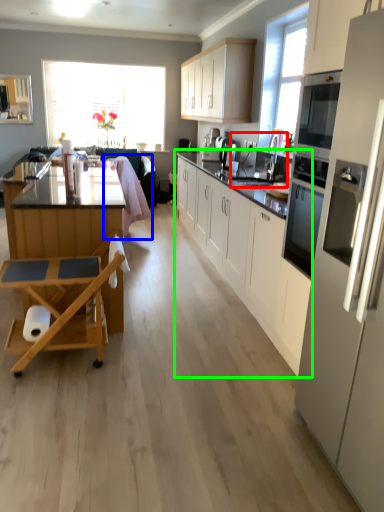
Question: Based on their relative distances, which object is nearer to sink (highlighted by a red box)? Choose from swivel chair (highlighted by a blue box) and cabinetry (highlighted by a green box).

Choices:
 (A) swivel chair
 (B) cabinetry

Answer: (B)